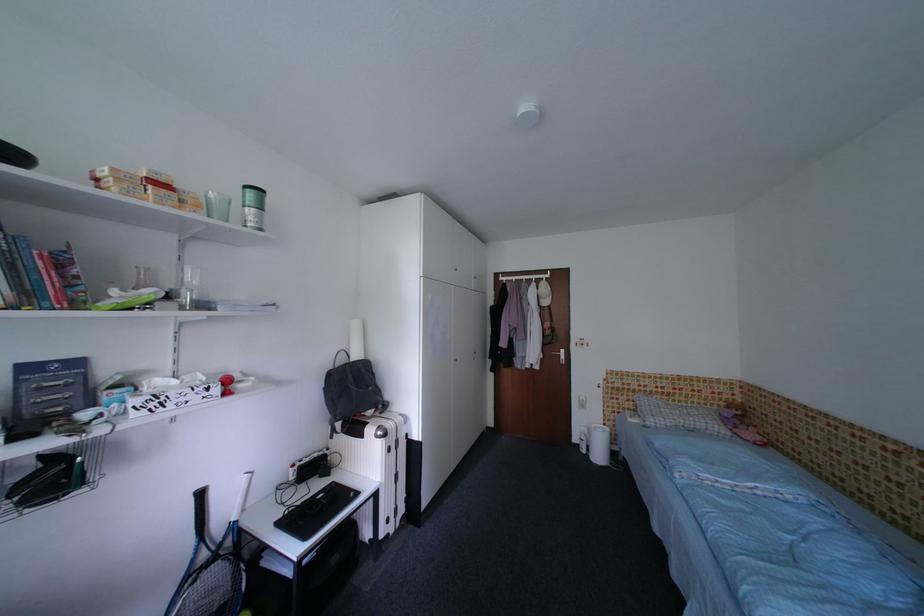
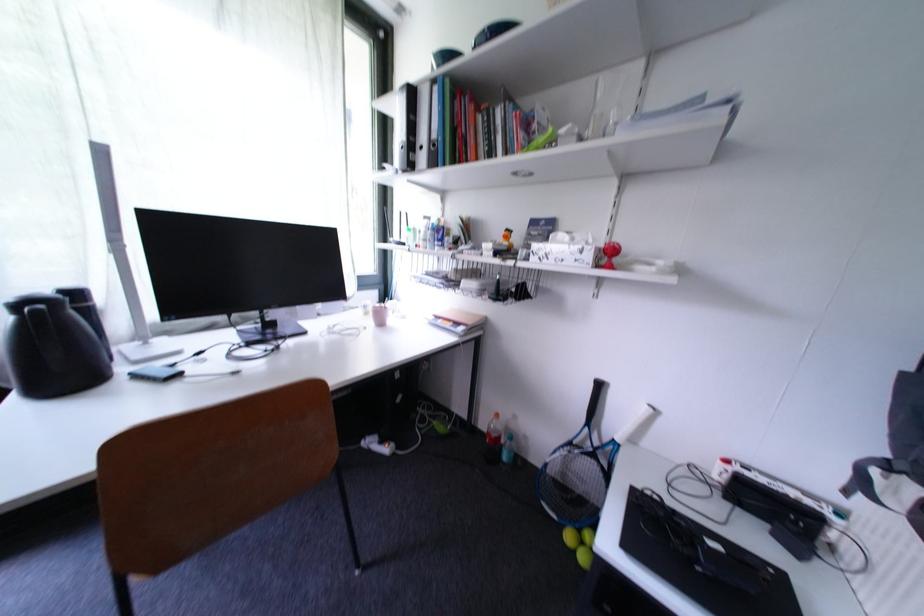
Find the pixel in the second image that matches the point at 215,392 in the first image.

(590, 253)